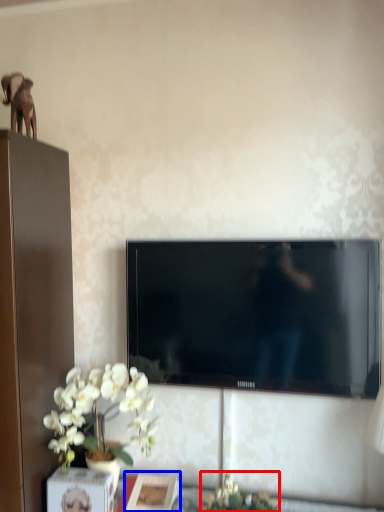
Question: Which of the following is the closest to the observer, plant (highlighted by a red box) or picture frame (highlighted by a blue box)?

Choices:
 (A) plant
 (B) picture frame

Answer: (A)